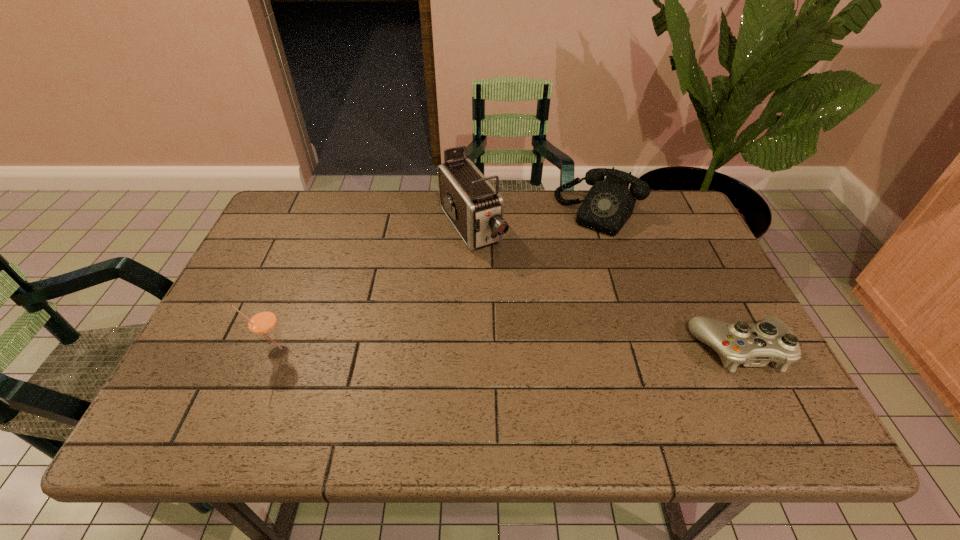
Locate an element on the screen. The image size is (960, 540). straw is located at coordinates (262, 322).

Identify the location of the second tallest object. The image size is (960, 540). (262, 322).

I want to click on the shortest object, so click(754, 345).

Locate an element on the screen. the tallest object is located at coordinates (475, 208).

Where is `the second object from left to right`? the second object from left to right is located at coordinates (475, 208).

Locate an element on the screen. the third tallest object is located at coordinates (609, 204).

Where is `free point located on the right of the leftmost object`? free point located on the right of the leftmost object is located at coordinates (326, 352).

Where is `free location located on the back of the control`? This screenshot has height=540, width=960. free location located on the back of the control is located at coordinates (701, 272).

Image resolution: width=960 pixels, height=540 pixels. What are the coordinates of `free location located 0.090m at the lens of the second object from left to right` in the screenshot? It's located at (501, 277).

Where is `blank space located 0.170m at the lens of the second object from left to right`? blank space located 0.170m at the lens of the second object from left to right is located at coordinates (516, 297).